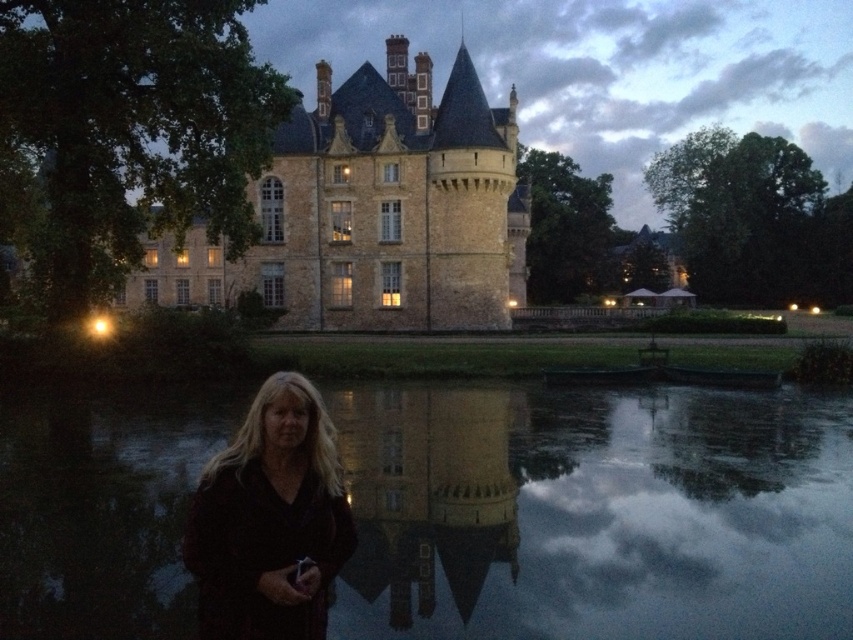
You are standing at the edge of the scene and want to walk to the smooth reflective water at center. Which direction should you move relative to the dark brown fabric at lower center?

The smooth reflective water at center is to the right of the dark brown fabric at lower center, so you should move to the right relative to the dark brown fabric at lower center to reach it.

You are standing at the point marked by the coordinate point at point (368, 497). You want to walk to the castle building in the scene. Which direction should you walk to reach it?

The point (368, 497) is 254.68 feet away from the viewer. To reach the castle building, you should walk towards the direction where the building is located, which is opposite to the viewer.